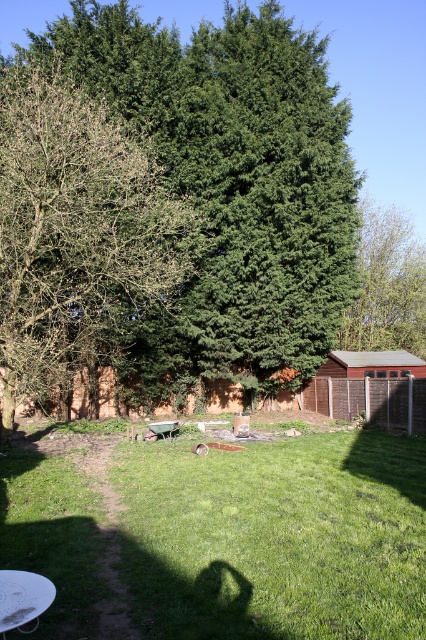
You are standing in the backyard and want to take a photo of both the green leafy tree at center and the green leafy tree at upper center. Which tree should you focus on first to ensure both are in the frame?

You should focus on the green leafy tree at upper center first because it is farther away from you than the green leafy tree at center, allowing both to be in the frame when properly composed.

You are standing in the backyard and want to take a photo of both the green leafy tree at center and the green leafy tree at upper center. Which tree should you position yourself closer to in order to capture both in the frame?

You should position yourself closer to the green leafy tree at center because it is to the left of the green leafy tree at upper center, allowing both to be in the frame when you adjust your camera angle.

You are standing at the point with coordinates point (46, 352) in the backyard. You want to walk to the point with coordinates point (164, 33). Which direction should you move relative to your current position?

To reach point (164, 33) from point (46, 352), you should move towards the upper left direction since point (164, 33) is behind point (46, 352).